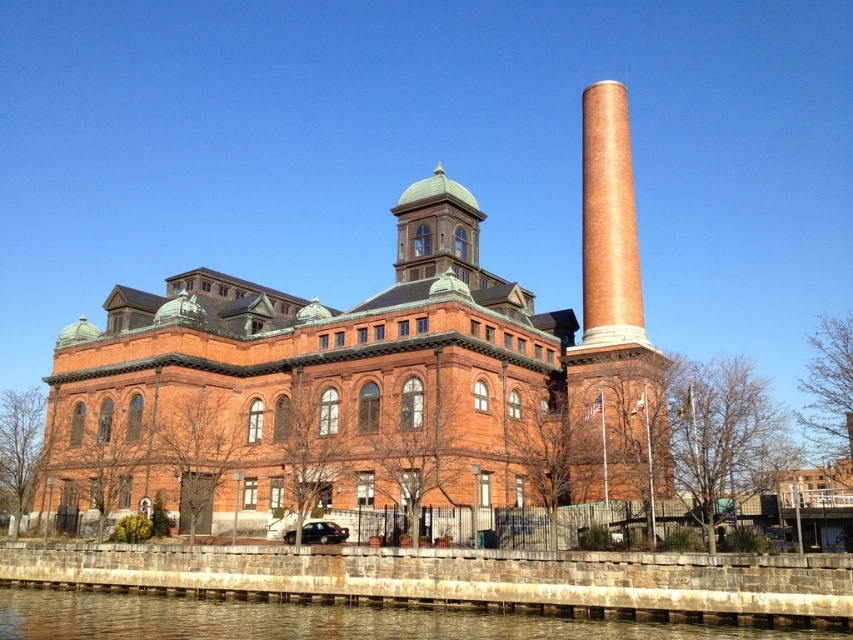
You are standing at the point marked by coordinates point (616,307). Looking towards the brick chimney at right, which direction should you face to see the building with the central dome?

Since the brick chimney at right is located to the right of the building with the central dome, facing away from the chimney towards the left would allow you to see the building with the central dome.

You are standing at the center of the image. Which direction should you look to see the brick chimney at right?

You should look to the right to see the brick chimney at right, as it is located at point (616, 307) which is to the right of the center.

You are a tourist standing in front of the historic brick building and want to take a photo that includes both the brick chimney at right and the brown stone wall at lower left. Which object should you move closer to in order to include both in your photo frame?

To include both the brick chimney at right and the brown stone wall at lower left in your photo frame, you should move closer to the brick chimney at right since it is closer to you than the brown stone wall at lower left.